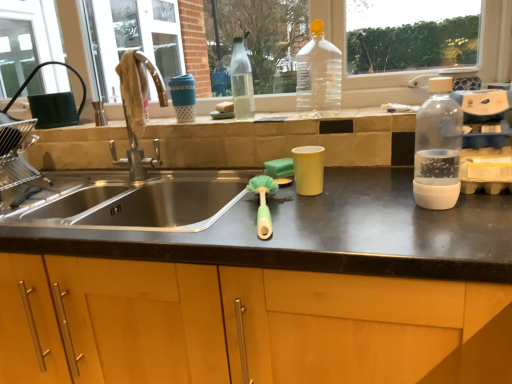
The width and height of the screenshot is (512, 384). Identify the location of free spot in front of transparent plastic bottle at right, the first bottle from the right. (441, 235).